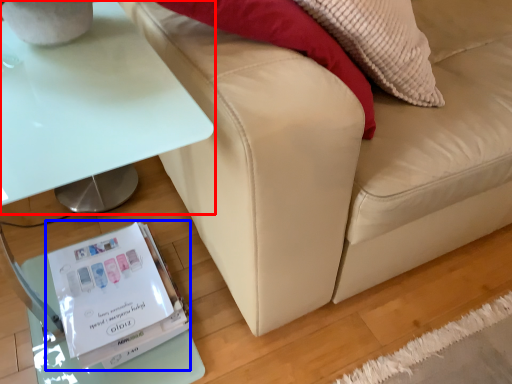
Question: Among these objects, which one is nearest to the camera, table (highlighted by a red box) or paperback book (highlighted by a blue box)?

Choices:
 (A) table
 (B) paperback book

Answer: (A)